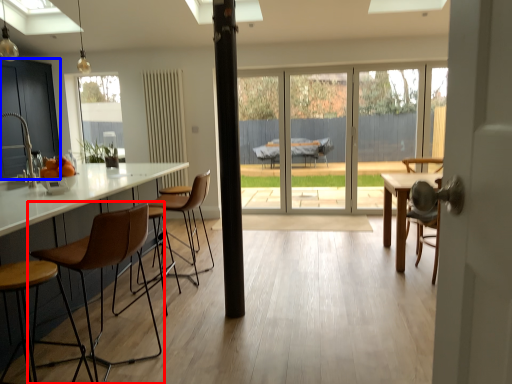
Question: Which object is closer to the camera taking this photo, chair (highlighted by a red box) or cabinetry (highlighted by a blue box)?

Choices:
 (A) chair
 (B) cabinetry

Answer: (A)